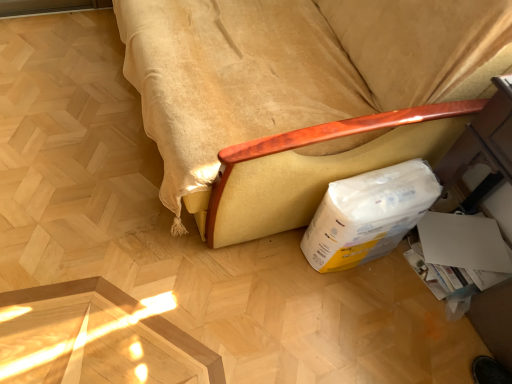
The width and height of the screenshot is (512, 384). Identify the location of free space in front of wooden armchair at lower right. (189, 283).